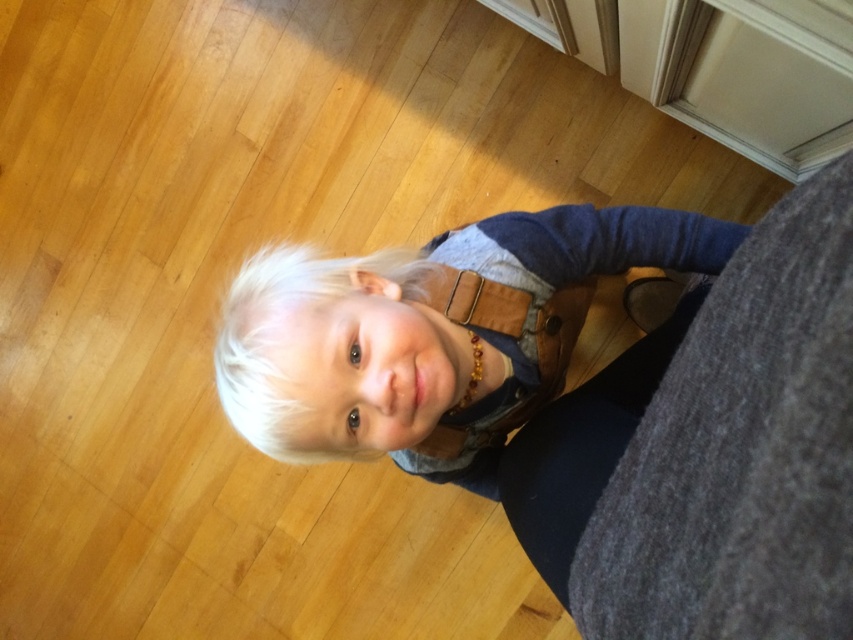
Is matte brown leather bag at center thinner than blonde hair at center?

No.

Is matte brown leather bag at center shorter than blonde hair at center?

No.

Who is more distant from viewer, [436,420] or [239,429]?

The point [239,429] is behind.

The width and height of the screenshot is (853, 640). I want to click on matte brown leather bag at center, so click(x=461, y=358).

Describe the element at coordinates (461, 358) in the screenshot. I see `matte brown leather bag at center` at that location.

Between point (541, 275) and point (439, 285), which one is positioned in front?

Point (439, 285) is more forward.

The width and height of the screenshot is (853, 640). I want to click on matte brown leather bag at center, so click(x=461, y=358).

Is point (306, 316) farther from camera compared to point (437, 296)?

No.

Between blonde hair at center and brown leather belt at center, which one is positioned higher?

brown leather belt at center is higher up.

Who is more distant from viewer, [283,372] or [491,292]?

Point [491,292]

The image size is (853, 640). Identify the location of blonde hair at center. (296, 348).